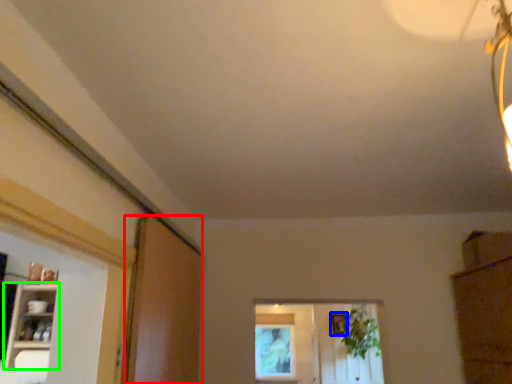
Question: Which object is positioned farthest from screen door (highlighted by a red box)? Select from picture frame (highlighted by a blue box) and shelf (highlighted by a green box).

Choices:
 (A) picture frame
 (B) shelf

Answer: (A)